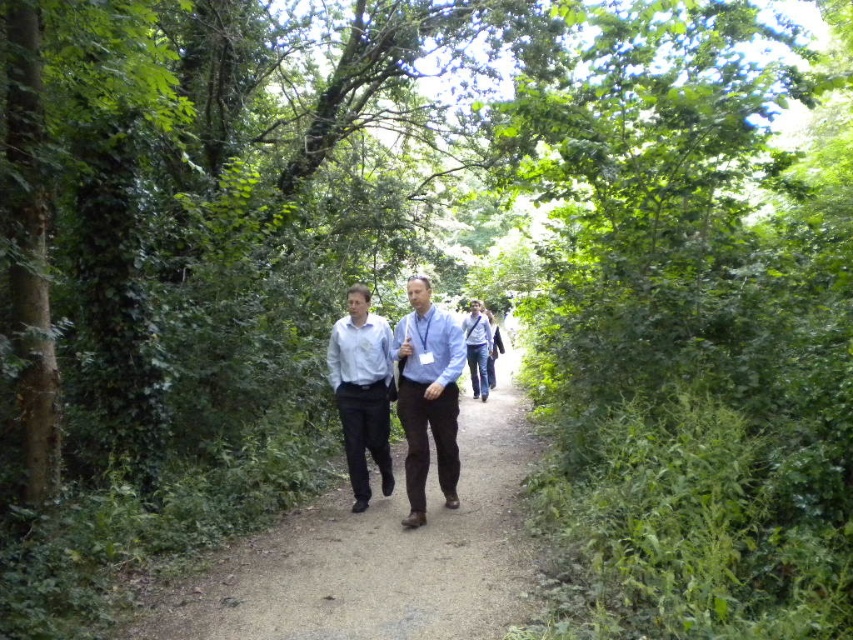
You are standing at point [376,556] in the image. What type of terrain are you currently on?

You are standing on the smooth dirt path at center located at point [376,556].

You are a photographer carrying a tripod that is 1 meter wide. You want to walk along the smooth dirt path at center while keeping the matte blue shirt at center in your frame. Can you move sideways with the tripod without leaving the path?

The smooth dirt path at center is wider than the matte blue shirt at center, so yes, you can move sideways with the tripod without leaving the path since the path is wider than the shirt.